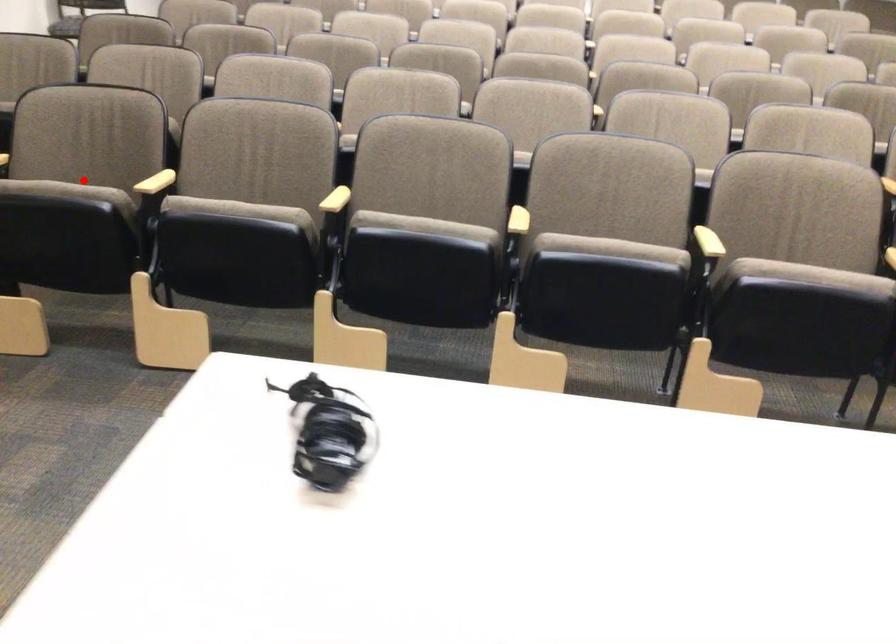
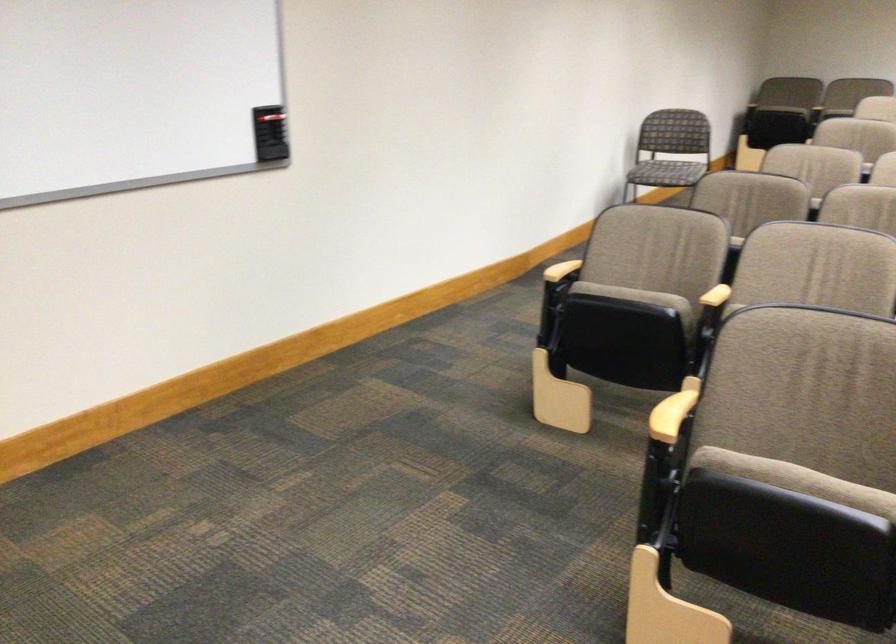
Where in the second image is the point corresponding to the highlighted location from the first image?

(796, 480)